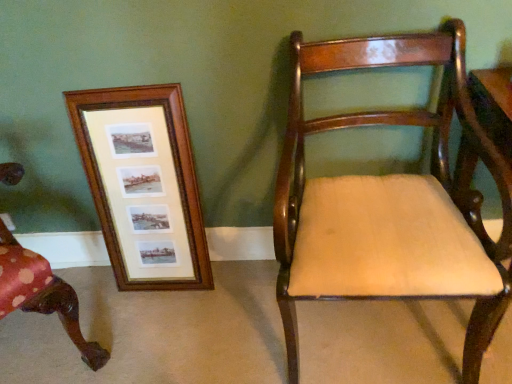
Find the location of a particular element. The image size is (512, 384). free location to the left of mahogany wood chair at right, the 1th chair viewed from the right is located at coordinates (220, 321).